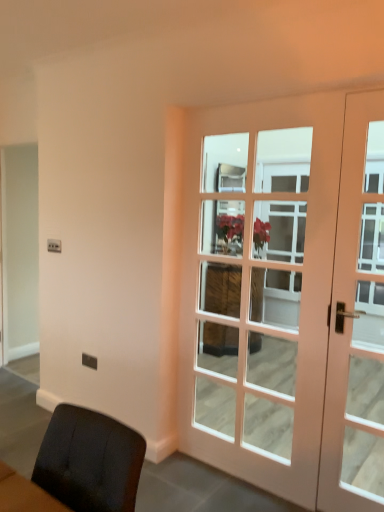
Question: Considering the relative sizes of matte white door at right, positioned as the second door in left-to-right order, and white wood door at right, the first door viewed from the left, in the image provided, is matte white door at right, positioned as the second door in left-to-right order, bigger than white wood door at right, the first door viewed from the left,?

Choices:
 (A) yes
 (B) no

Answer: (B)

Question: From the image's perspective, is matte white door at right, positioned as the second door in left-to-right order, under white wood door at right, the first door viewed from the left?

Choices:
 (A) no
 (B) yes

Answer: (B)

Question: Is matte white door at right, positioned as the second door in left-to-right order, positioned before white wood door at right, the 2th door viewed from the right?

Choices:
 (A) yes
 (B) no

Answer: (B)

Question: Is matte white door at right, which is the 1th door from right to left, wider than white wood door at right, the first door viewed from the left?

Choices:
 (A) no
 (B) yes

Answer: (A)

Question: Does matte white door at right, positioned as the second door in left-to-right order, come behind white wood door at right, the first door viewed from the left?

Choices:
 (A) yes
 (B) no

Answer: (A)

Question: Is matte white door at right, positioned as the second door in left-to-right order, shorter than white wood door at right, the 2th door viewed from the right?

Choices:
 (A) no
 (B) yes

Answer: (B)

Question: Does white wood door at right, the first door viewed from the left, have a lesser height compared to matte white door at right, positioned as the second door in left-to-right order?

Choices:
 (A) no
 (B) yes

Answer: (A)

Question: From the image's perspective, is white wood door at right, the first door viewed from the left, located beneath matte white door at right, positioned as the second door in left-to-right order?

Choices:
 (A) no
 (B) yes

Answer: (A)

Question: Is white wood door at right, the first door viewed from the left, positioned beyond the bounds of matte white door at right, positioned as the second door in left-to-right order?

Choices:
 (A) no
 (B) yes

Answer: (B)

Question: Does white wood door at right, the 2th door viewed from the right, lie behind matte white door at right, positioned as the second door in left-to-right order?

Choices:
 (A) no
 (B) yes

Answer: (A)

Question: From a real-world perspective, is white wood door at right, the first door viewed from the left, over matte white door at right, which is the 1th door from right to left?

Choices:
 (A) no
 (B) yes

Answer: (B)

Question: From the image's perspective, is white wood door at right, the first door viewed from the left, located above matte white door at right, which is the 1th door from right to left?

Choices:
 (A) no
 (B) yes

Answer: (B)

Question: Based on their sizes in the image, would you say white wood door at right, the 2th door viewed from the right, is bigger or smaller than matte white door at right, which is the 1th door from right to left?

Choices:
 (A) big
 (B) small

Answer: (A)